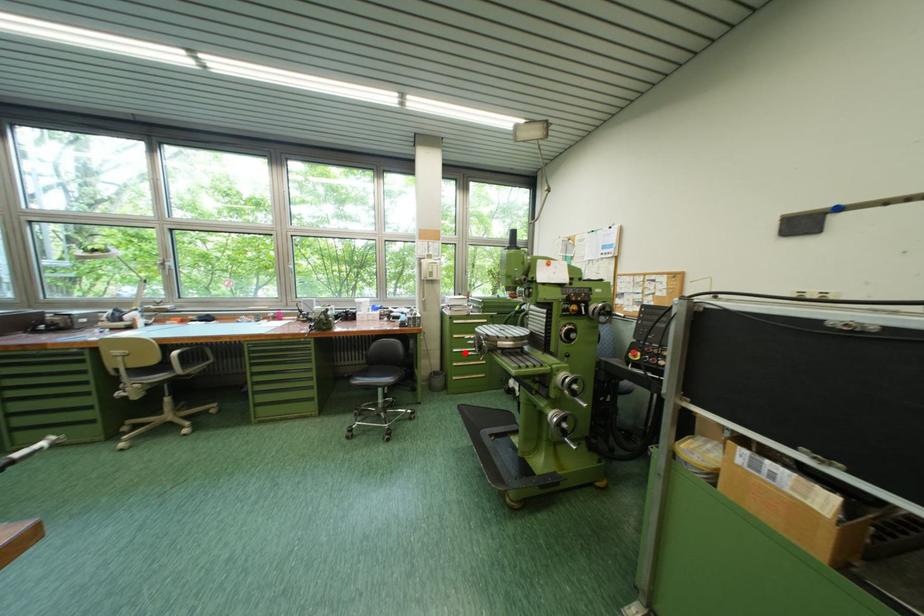
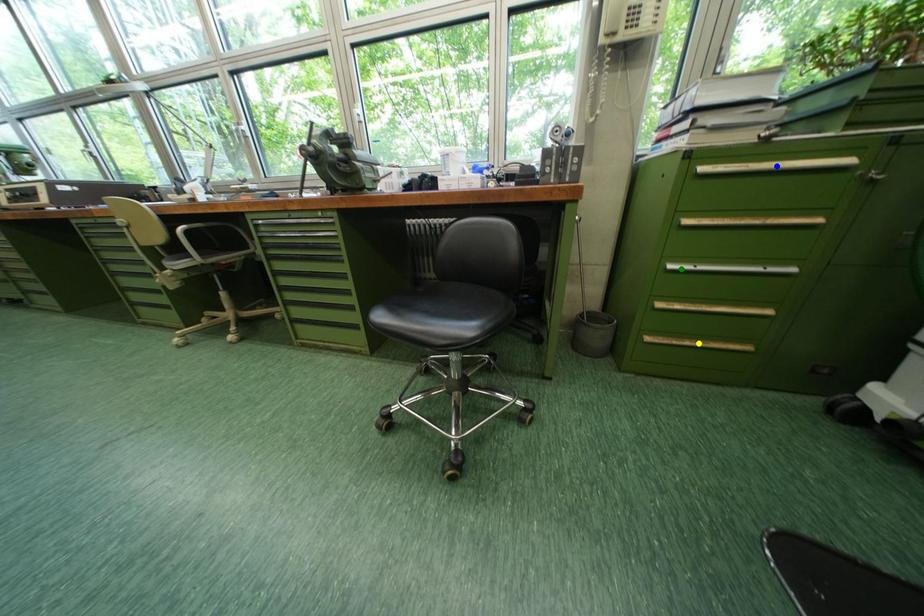
Question: I am providing you with two images of the same scene from different viewpoints. A red point is marked on the first image. You are given multiple points on the second image. Which mark in image 2 goes with the point in image 1?

Choices:
 (A) blue point
 (B) yellow point
 (C) green point

Answer: (C)